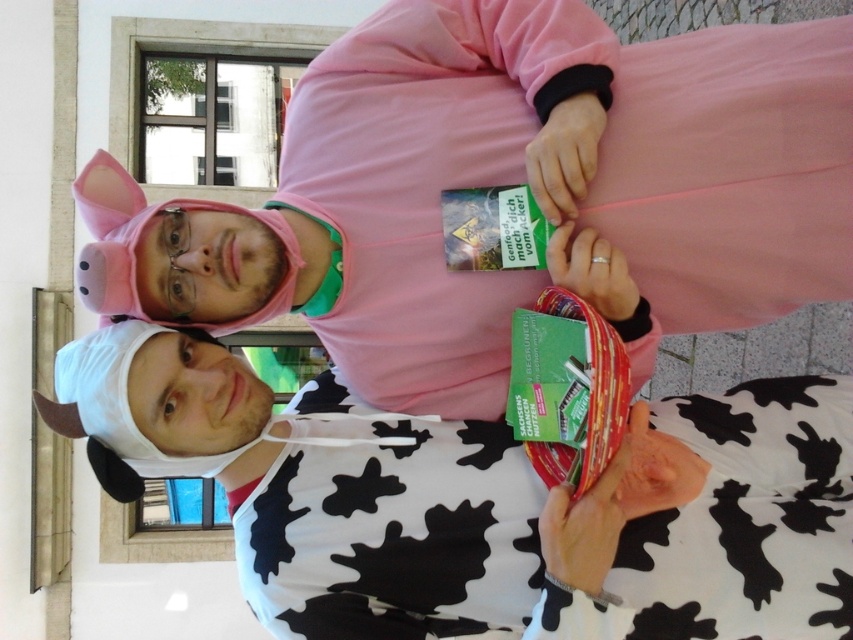
Question: Is pink fleece at upper center wider than white cow print hoodie at center?

Choices:
 (A) no
 (B) yes

Answer: (A)

Question: Which point is closer to the camera?

Choices:
 (A) pink fleece at upper center
 (B) white cow print hoodie at center

Answer: (B)

Question: In this image, where is pink fleece at upper center located relative to white cow print hoodie at center?

Choices:
 (A) left
 (B) right

Answer: (B)

Question: Can you confirm if pink fleece at upper center is positioned below white cow print hoodie at center?

Choices:
 (A) yes
 (B) no

Answer: (B)

Question: Among these objects, which one is farthest from the camera?

Choices:
 (A) pink fleece at upper center
 (B) white cow print hoodie at center

Answer: (A)